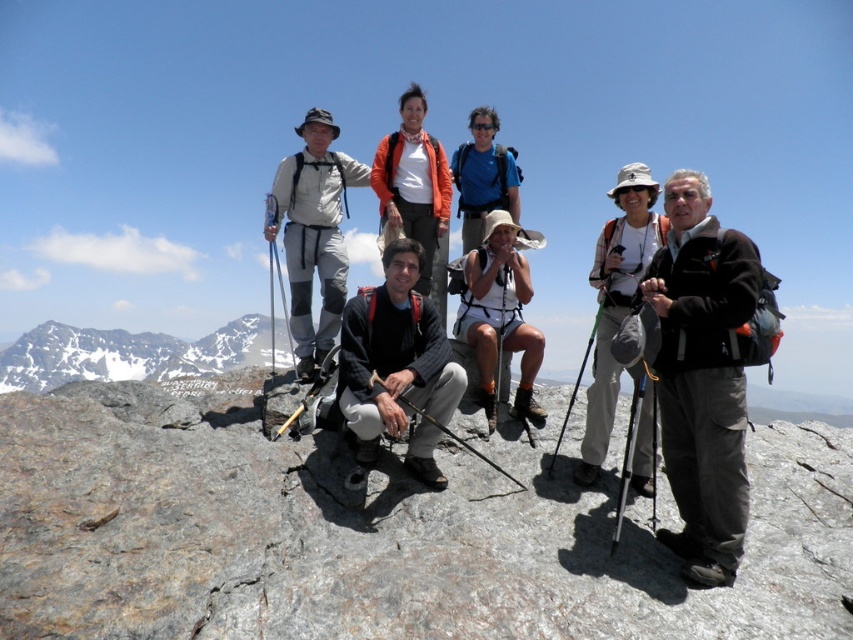
You are a hiker who needs to place a small first aid kit on the ground near the gray rock at center and the blue fabric backpack at center. Which object should you place it closer to if you want the kit to be closer to the smaller object?

The gray rock at center is smaller than the blue fabric backpack at center, so placing the first aid kit closer to the gray rock at center will ensure it is near the smaller object.